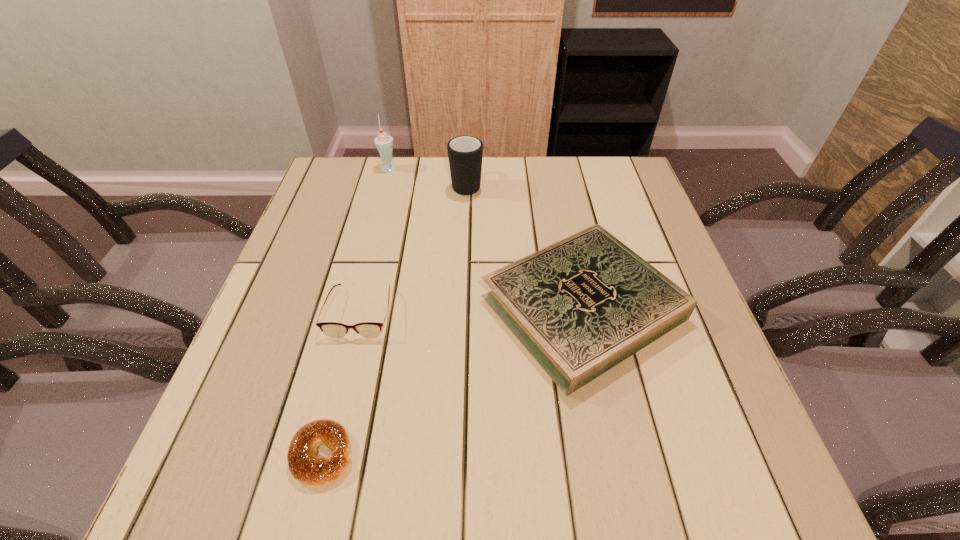
This screenshot has width=960, height=540. I want to click on object present at the far left corner, so click(x=384, y=143).

At what (x,y) coordinates should I click in order to perform the action: click on object present at the near left corner. Please return your answer as a coordinate pair (x, y). Image resolution: width=960 pixels, height=540 pixels. Looking at the image, I should click on (306, 466).

Image resolution: width=960 pixels, height=540 pixels. Identify the location of vacant area at the far edge of the desktop. click(464, 199).

The height and width of the screenshot is (540, 960). I want to click on free spot at the near edge of the desktop, so click(x=629, y=484).

This screenshot has height=540, width=960. What are the coordinates of `vacant space at the left edge of the desktop` in the screenshot? It's located at (248, 417).

Where is `free region at the right edge`? The height and width of the screenshot is (540, 960). free region at the right edge is located at coordinates (596, 214).

The image size is (960, 540). Find the location of `vacant space at the far left corner`. vacant space at the far left corner is located at coordinates (x=349, y=188).

Find the location of a particular element. The height and width of the screenshot is (540, 960). vacant area at the near left corner is located at coordinates (276, 470).

Where is `vacant area at the far right corner`? Image resolution: width=960 pixels, height=540 pixels. vacant area at the far right corner is located at coordinates (611, 165).

Find the location of a particular element. The height and width of the screenshot is (540, 960). empty location between the milkshake and the nearest object is located at coordinates (356, 310).